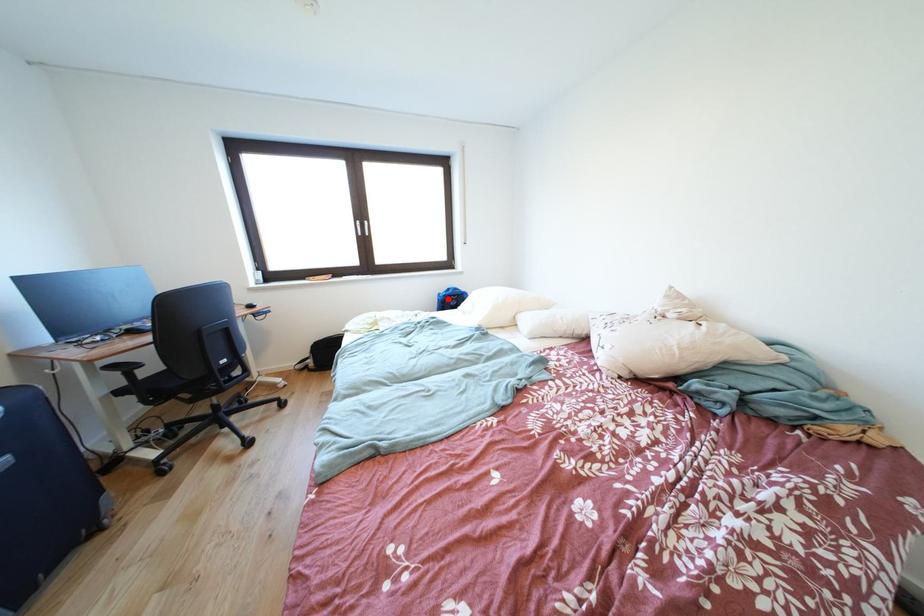
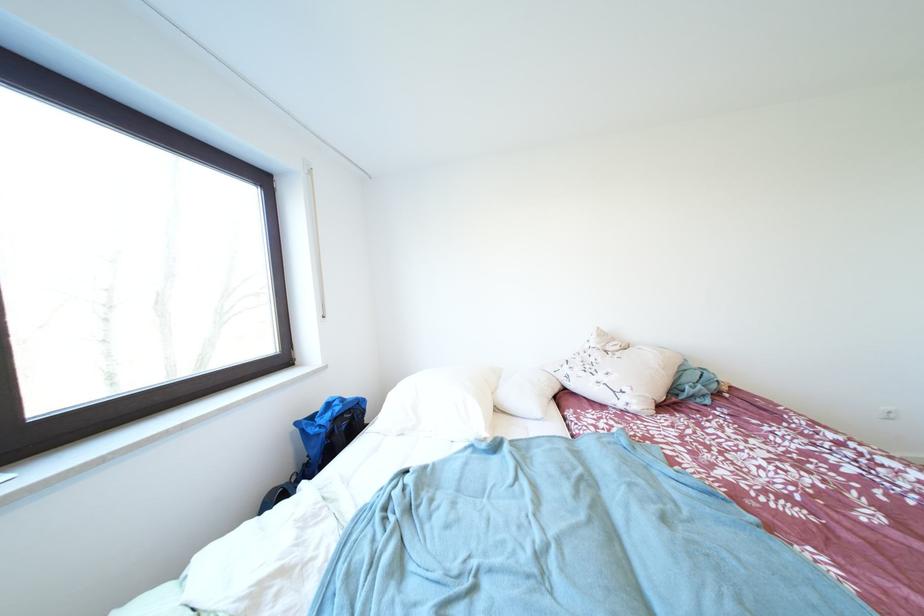
Locate, in the second image, the point that corresponds to the highlighted location in the first image.

(305, 428)